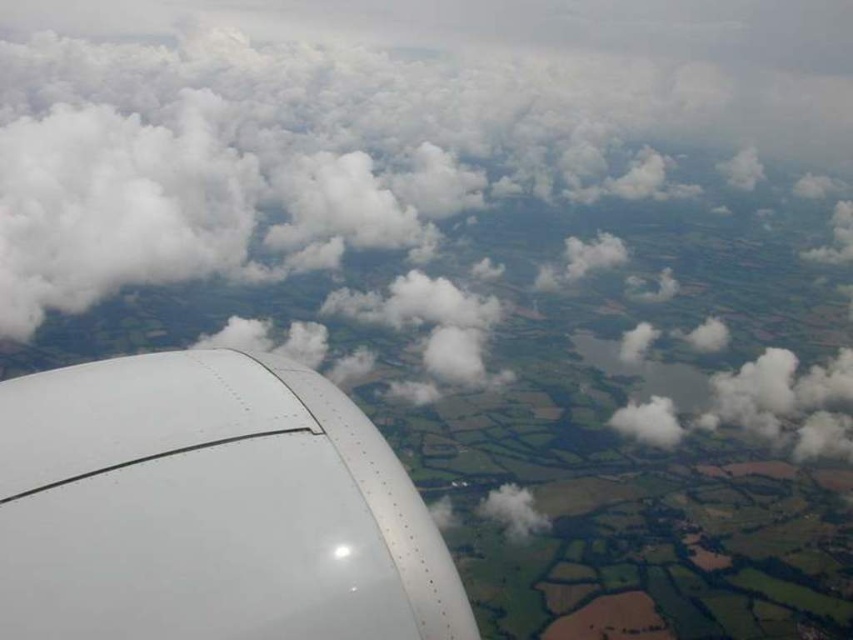
Question: Does white fluffy cloud at lower left appear over white matte engine at lower left?

Choices:
 (A) yes
 (B) no

Answer: (A)

Question: Which object appears farthest from the camera in this image?

Choices:
 (A) white fluffy cloud at lower left
 (B) white matte engine at lower left

Answer: (A)

Question: Is white fluffy cloud at lower left above white matte engine at lower left?

Choices:
 (A) yes
 (B) no

Answer: (A)

Question: Does white fluffy cloud at lower left appear on the left side of white matte engine at lower left?

Choices:
 (A) no
 (B) yes

Answer: (B)

Question: Which object appears closest to the camera in this image?

Choices:
 (A) white matte engine at lower left
 (B) white fluffy cloud at lower left

Answer: (A)

Question: Which point is closer to the camera taking this photo?

Choices:
 (A) (248, 540)
 (B) (846, 90)

Answer: (A)